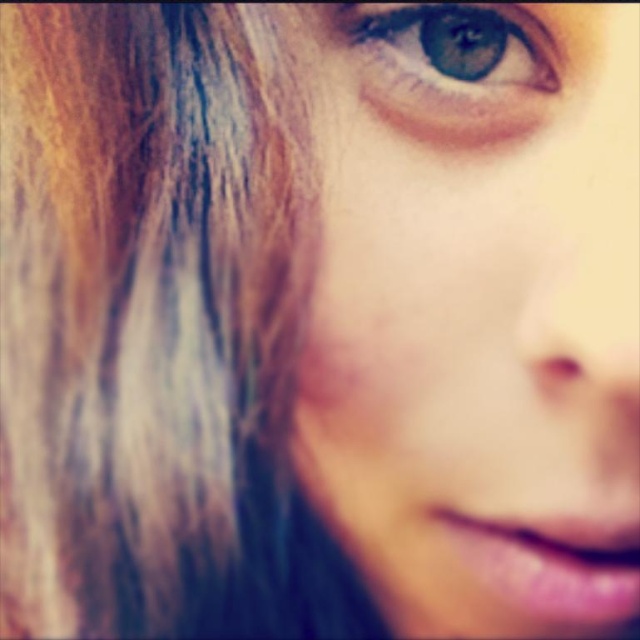
Is point (369, 433) more distant than point (429, 88)?

No, (369, 433) is closer to viewer.

Between smooth skin face at upper right and blue glossy eye at upper center, which one is positioned higher?

blue glossy eye at upper center is higher up.

Is point (538, 605) closer to camera compared to point (451, 99)?

Yes.

Locate an element on the screen. This screenshot has height=640, width=640. smooth skin face at upper right is located at coordinates (476, 310).

How far apart are smooth skin face at upper right and shiny brown hair at left?

A distance of 2.64 inches exists between smooth skin face at upper right and shiny brown hair at left.

In the scene shown: Who is positioned more to the right, smooth skin face at upper right or shiny brown hair at left?

smooth skin face at upper right

Which is in front, point (596, 378) or point (292, 122)?

Point (596, 378) is more forward.

Where is `smooth skin face at upper right`? The height and width of the screenshot is (640, 640). smooth skin face at upper right is located at coordinates (476, 310).

Is point (68, 598) positioned behind point (356, 49)?

Yes.

How distant is shiny brown hair at left from blue glossy eye at upper center?

The distance of shiny brown hair at left from blue glossy eye at upper center is 4.72 inches.

Between point (316, 628) and point (524, 35), which one is positioned behind?

The point (316, 628) is more distant.

The width and height of the screenshot is (640, 640). In order to click on shiny brown hair at left in this screenshot , I will do `click(156, 328)`.